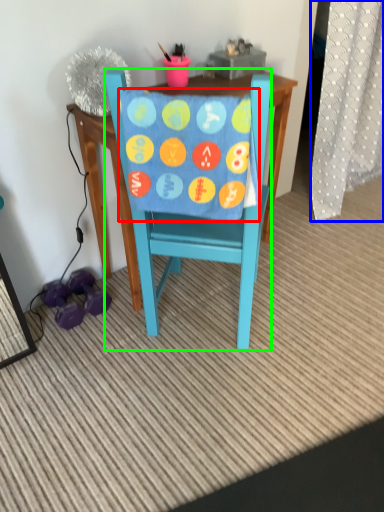
Question: Which object is positioned farthest from blanket (highlighted by a red box)? Select from curtain (highlighted by a blue box) and chair (highlighted by a green box).

Choices:
 (A) curtain
 (B) chair

Answer: (A)